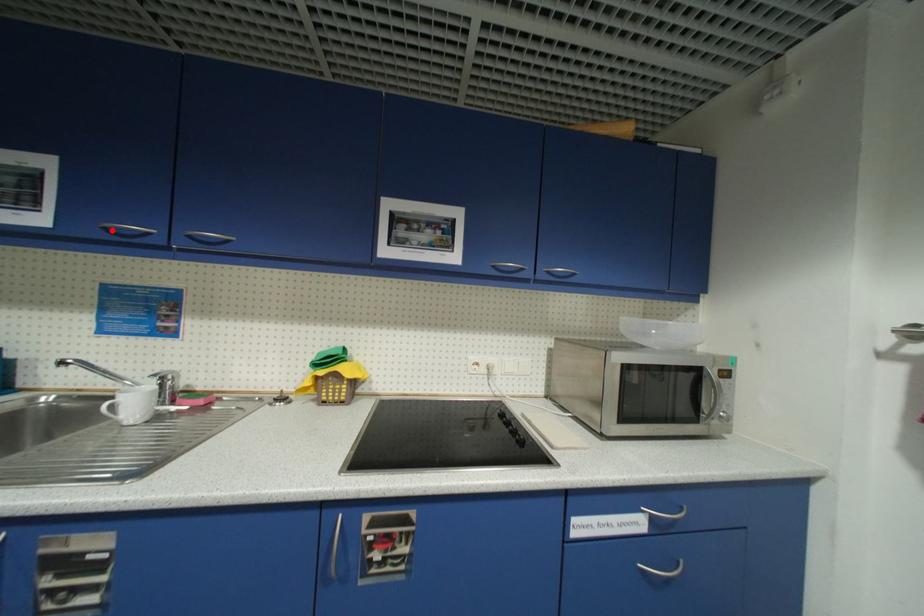
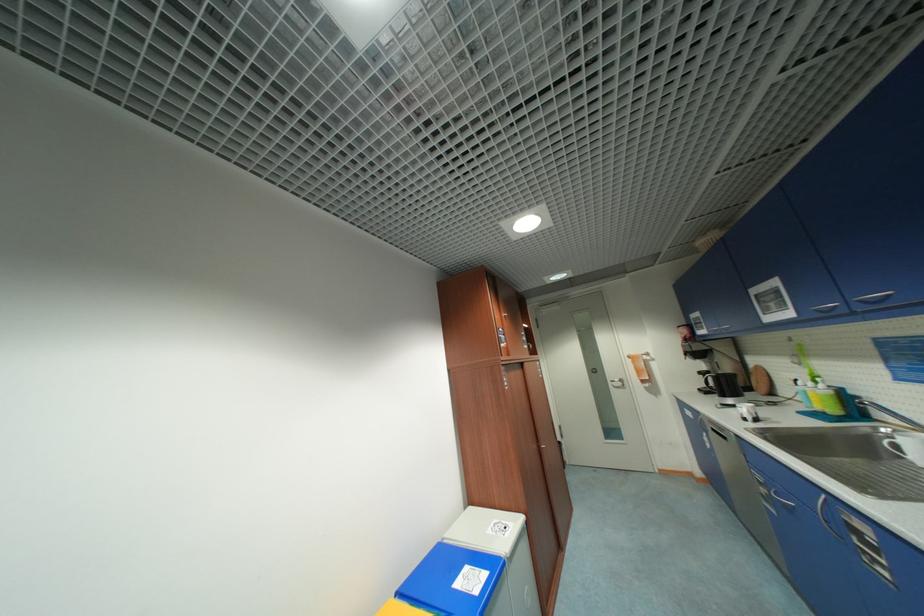
The point at the highlighted location is marked in the first image. Where is the corresponding point in the second image?

(822, 312)